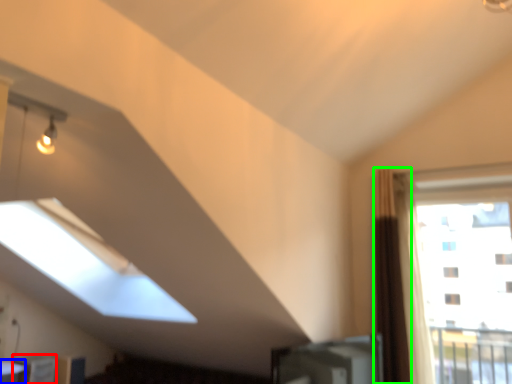
Question: Which object is the farthest from furniture (highlighted by a red box)? Choose among these: table (highlighted by a blue box) or curtain (highlighted by a green box).

Choices:
 (A) table
 (B) curtain

Answer: (B)